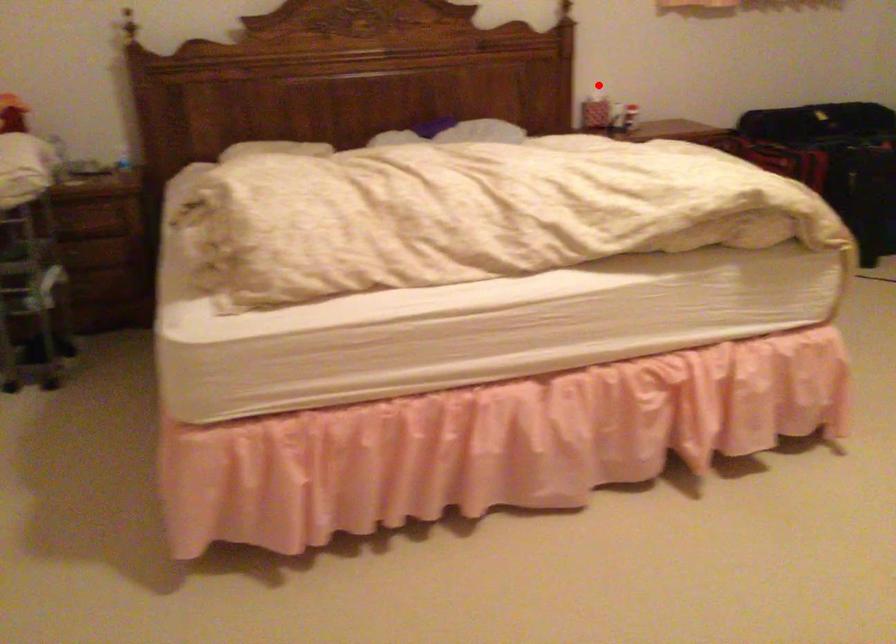
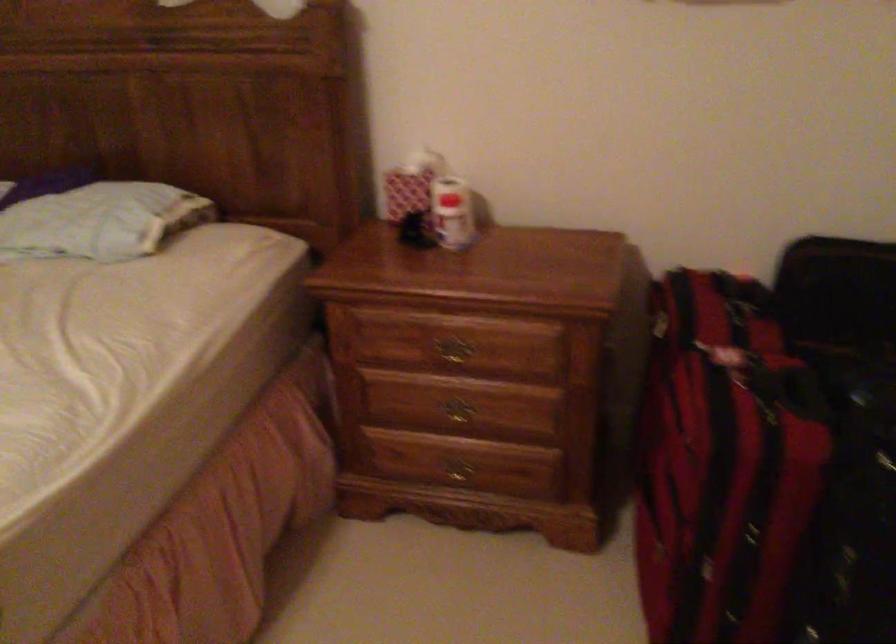
Question: A red point is marked in image1. In image2, is the corresponding 3D point closer to the camera or farther? Reply with the corresponding letter.

Choices:
 (A) The corresponding 3D point is closer.
 (B) The corresponding 3D point is farther.

Answer: (A)